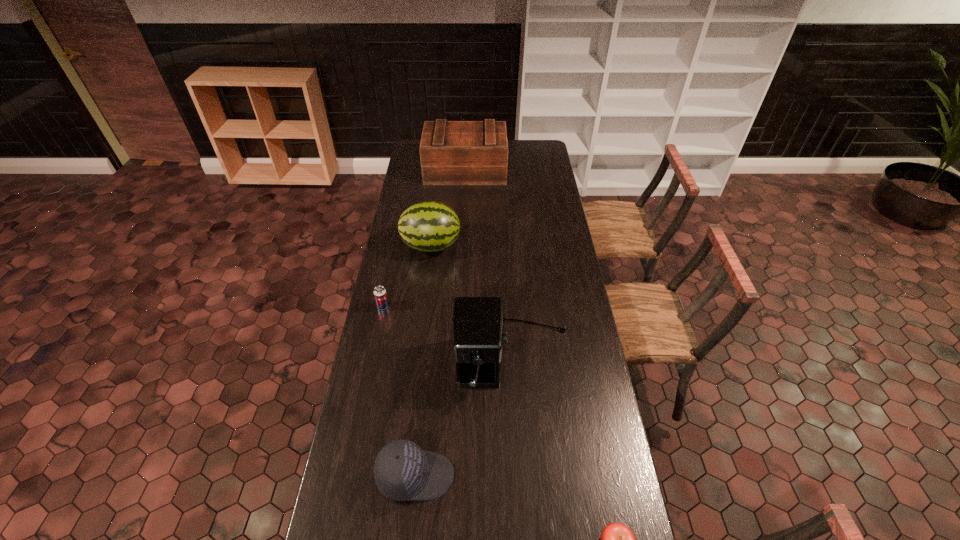
Where is `the farthest object`? This screenshot has height=540, width=960. the farthest object is located at coordinates (451, 152).

Locate an element on the screen. This screenshot has width=960, height=540. the third nearest object is located at coordinates (478, 322).

Locate an element on the screen. the fifth nearest object is located at coordinates (429, 226).

Image resolution: width=960 pixels, height=540 pixels. I want to click on the fourth tallest object, so click(x=403, y=471).

In order to click on the second nearest object in this screenshot , I will do `click(403, 471)`.

At what (x,y) coordinates should I click in order to perform the action: click on the leftmost object. Please return your answer as a coordinate pair (x, y). The height and width of the screenshot is (540, 960). Looking at the image, I should click on (380, 294).

Find the location of `the third farthest object`. the third farthest object is located at coordinates (380, 294).

At what (x,y) coordinates should I click in order to perform the action: click on vacant space located 0.150m on the front of the farthest object. Please return your answer as a coordinate pair (x, y). Looking at the image, I should click on (464, 201).

Identify the location of free space located on the front-facing side of the fourth farthest object. This screenshot has width=960, height=540. (519, 463).

Image resolution: width=960 pixels, height=540 pixels. Find the location of `free space located at the stem end of the second farthest object`. free space located at the stem end of the second farthest object is located at coordinates (527, 246).